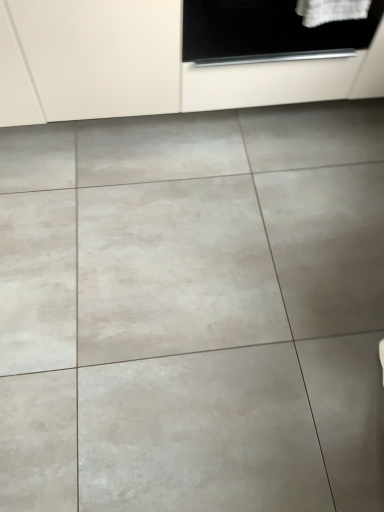
Locate an element on the screen. This screenshot has height=512, width=384. white matte cabinet at upper center is located at coordinates (145, 65).

The height and width of the screenshot is (512, 384). What do you see at coordinates (145, 65) in the screenshot?
I see `white matte cabinet at upper center` at bounding box center [145, 65].

Image resolution: width=384 pixels, height=512 pixels. I want to click on white matte cabinet at upper center, so click(145, 65).